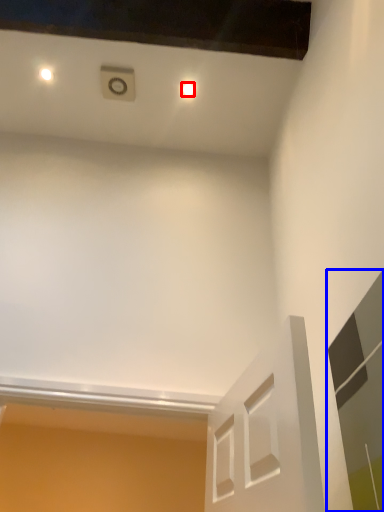
Question: Which object is further to the camera taking this photo, dot (highlighted by a red box) or glass door (highlighted by a blue box)?

Choices:
 (A) dot
 (B) glass door

Answer: (A)